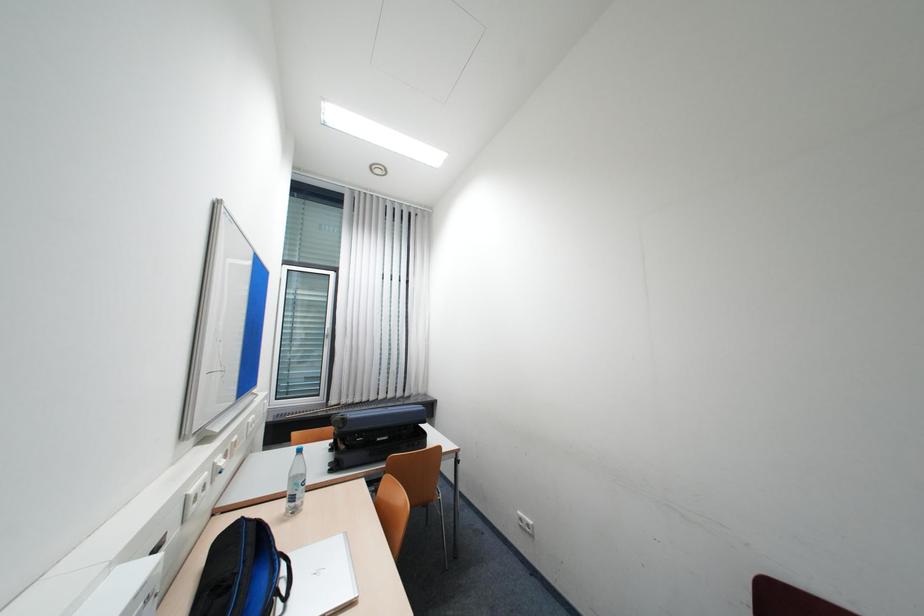
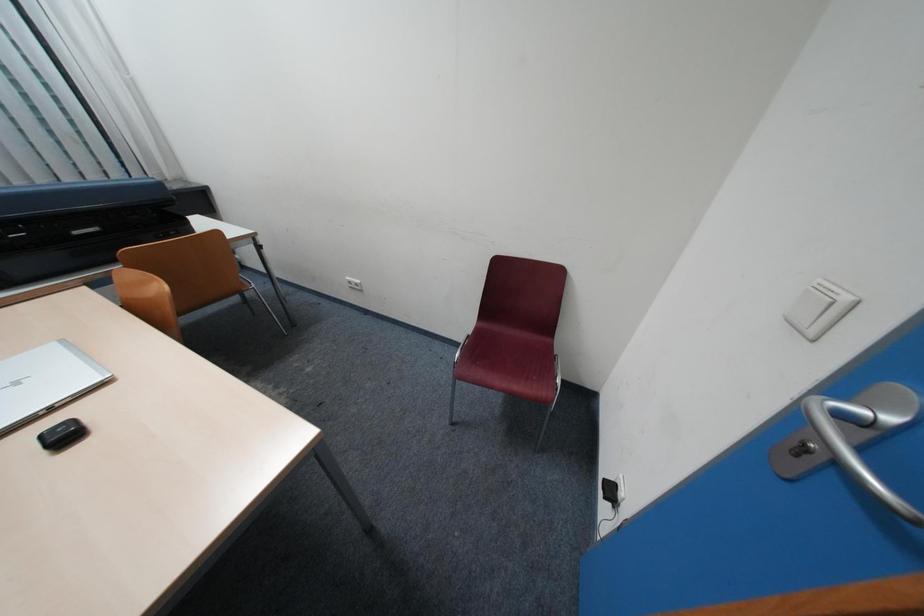
From the picture: The images are taken continuously from a first-person perspective. In which direction is your viewpoint rotating?

The camera rotated toward right-down.